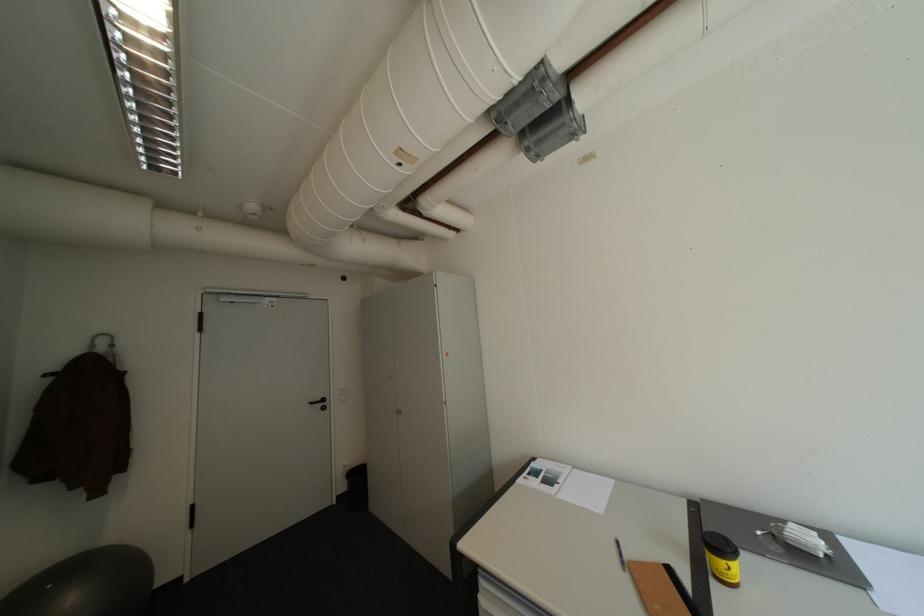
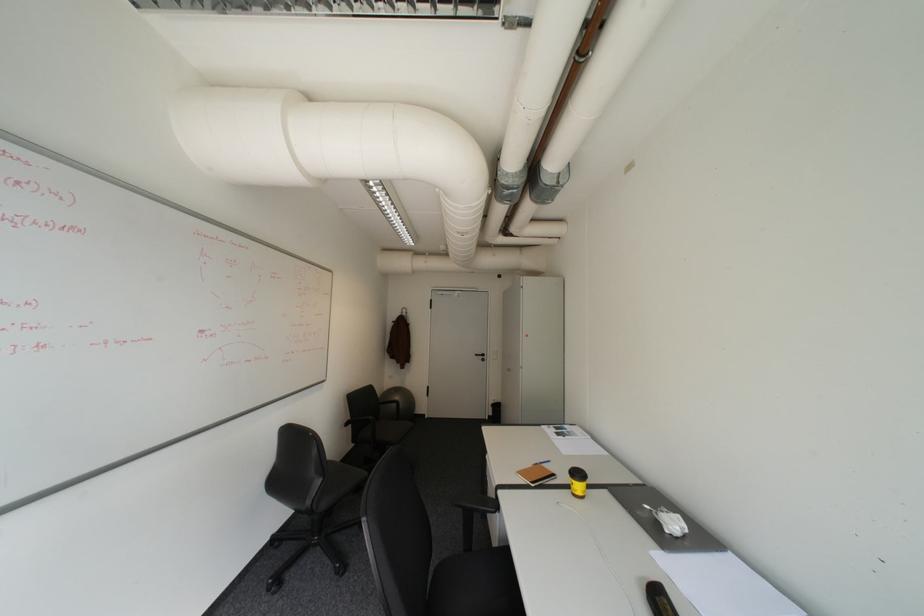
Find the pixel in the second image that matches point 743,564 in the first image.

(584, 482)